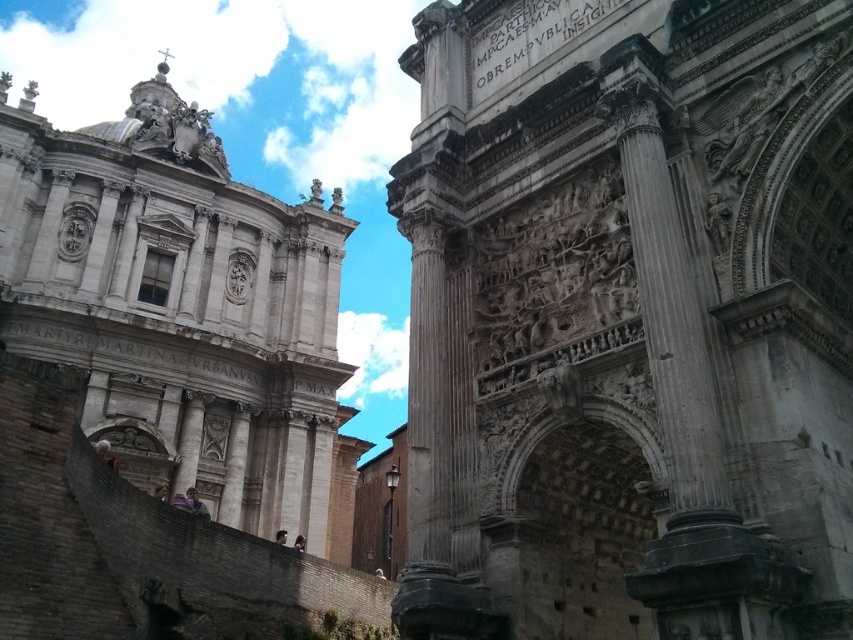
Between gray stone arch at center and white stone tower at upper left, which one appears on the right side from the viewer's perspective?

Positioned to the right is gray stone arch at center.

Based on the photo, can you confirm if gray stone arch at center is bigger than white stone tower at upper left?

Incorrect, gray stone arch at center is not larger than white stone tower at upper left.

At what (x,y) coordinates should I click in order to perform the action: click on gray stone arch at center. Please return your answer as a coordinate pair (x, y). The height and width of the screenshot is (640, 853). Looking at the image, I should click on (630, 321).